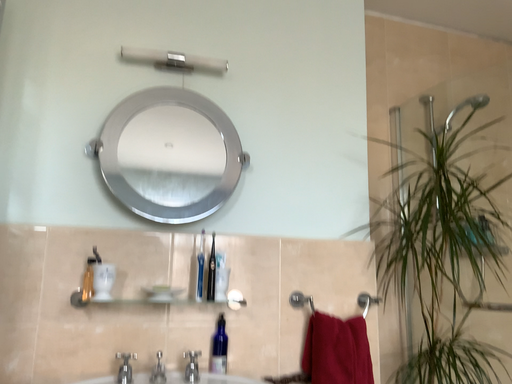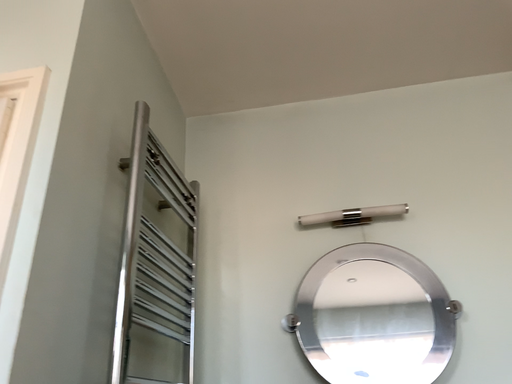
Question: How did the camera likely rotate when shooting the video?

Choices:
 (A) rotated left
 (B) rotated right

Answer: (A)